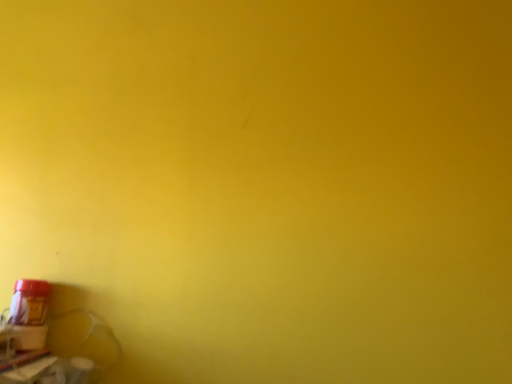
This screenshot has width=512, height=384. Describe the element at coordinates (26, 367) in the screenshot. I see `matte plastic window sill at lower left` at that location.

You are a GUI agent. You are given a task and a screenshot of the screen. Output one action in this format:
    pyautogui.click(x=<x>, y=<y>)
    Task: Click on the matte plastic window sill at lower left
    This screenshot has width=512, height=384.
    Given the screenshot: What is the action you would take?
    pyautogui.click(x=26, y=367)

What is the approximate height of matte red plastic bottle at bottom left?

matte red plastic bottle at bottom left is 4.69 inches tall.

The image size is (512, 384). What do you see at coordinates (29, 314) in the screenshot?
I see `matte red plastic bottle at bottom left` at bounding box center [29, 314].

Where is `matte red plastic bottle at bottom left`? The image size is (512, 384). matte red plastic bottle at bottom left is located at coordinates point(29,314).

This screenshot has width=512, height=384. I want to click on matte plastic window sill at lower left, so click(26, 367).

In the image, is matte red plastic bottle at bottom left on the left side or the right side of matte plastic window sill at lower left?

Based on their positions, matte red plastic bottle at bottom left is located to the right of matte plastic window sill at lower left.

Is matte red plastic bottle at bottom left closer to the viewer compared to matte plastic window sill at lower left?

No, matte red plastic bottle at bottom left is behind matte plastic window sill at lower left.

Considering the points (14, 299) and (52, 357), which point is in front, point (14, 299) or point (52, 357)?

Positioned in front is point (52, 357).

From the image's perspective, is matte red plastic bottle at bottom left on top of matte plastic window sill at lower left?

Yes.

From a real-world perspective, is matte red plastic bottle at bottom left on top of matte plastic window sill at lower left?

Correct, in the physical world, matte red plastic bottle at bottom left is higher than matte plastic window sill at lower left.

Considering the relative sizes of matte red plastic bottle at bottom left and matte plastic window sill at lower left in the image provided, is matte red plastic bottle at bottom left wider than matte plastic window sill at lower left?

In fact, matte red plastic bottle at bottom left might be narrower than matte plastic window sill at lower left.

In terms of height, does matte red plastic bottle at bottom left look taller or shorter compared to matte plastic window sill at lower left?

In the image, matte red plastic bottle at bottom left appears to be taller than matte plastic window sill at lower left.

Based on the photo, between matte red plastic bottle at bottom left and matte plastic window sill at lower left, which one has smaller size?

matte red plastic bottle at bottom left is smaller.

In the scene shown: Is matte red plastic bottle at bottom left not inside matte plastic window sill at lower left?

Indeed, matte red plastic bottle at bottom left is completely outside matte plastic window sill at lower left.

Would you consider matte red plastic bottle at bottom left to be distant from matte plastic window sill at lower left?

matte red plastic bottle at bottom left is near matte plastic window sill at lower left, not far away.

Could you tell me if matte red plastic bottle at bottom left is turned towards matte plastic window sill at lower left?

No, matte red plastic bottle at bottom left is not aimed at matte plastic window sill at lower left.

Based on the photo, can you tell me how much matte red plastic bottle at bottom left and matte plastic window sill at lower left differ in facing direction?

They differ by 1.66 degrees in their facing directions.

Measure the distance between matte red plastic bottle at bottom left and matte plastic window sill at lower left.

The distance of matte red plastic bottle at bottom left from matte plastic window sill at lower left is 2.12 inches.

Locate an element on the screen. The width and height of the screenshot is (512, 384). window sill in front of the matte red plastic bottle at bottom left is located at coordinates (26, 367).

Which object is positioned more to the right, matte plastic window sill at lower left or matte red plastic bottle at bottom left?

Positioned to the right is matte red plastic bottle at bottom left.

Which object is closer to the camera, matte plastic window sill at lower left or matte red plastic bottle at bottom left?

Positioned in front is matte plastic window sill at lower left.

Considering the points (46, 365) and (10, 305), which point is in front, point (46, 365) or point (10, 305)?

Positioned in front is point (46, 365).

Looking at this image, from the image's perspective, between matte plastic window sill at lower left and matte red plastic bottle at bottom left, which one is located above?

matte red plastic bottle at bottom left.

From a real-world perspective, is matte plastic window sill at lower left beneath matte red plastic bottle at bottom left?

Yes, from a real-world perspective, matte plastic window sill at lower left is below matte red plastic bottle at bottom left.

Considering the sizes of objects matte plastic window sill at lower left and matte red plastic bottle at bottom left in the image provided, who is wider, matte plastic window sill at lower left or matte red plastic bottle at bottom left?

Wider between the two is matte plastic window sill at lower left.

From their relative heights in the image, would you say matte plastic window sill at lower left is taller or shorter than matte red plastic bottle at bottom left?

Considering their sizes, matte plastic window sill at lower left has less height than matte red plastic bottle at bottom left.

Consider the image. Can you confirm if matte plastic window sill at lower left is smaller than matte red plastic bottle at bottom left?

Actually, matte plastic window sill at lower left might be larger than matte red plastic bottle at bottom left.

Is matte plastic window sill at lower left not inside matte red plastic bottle at bottom left?

Yes, matte plastic window sill at lower left is outside of matte red plastic bottle at bottom left.

Is matte plastic window sill at lower left directly adjacent to matte red plastic bottle at bottom left?

Indeed, matte plastic window sill at lower left and matte red plastic bottle at bottom left are beside each other and touching.

Is matte plastic window sill at lower left facing towards matte red plastic bottle at bottom left?

No.

What's the angular difference between matte plastic window sill at lower left and matte red plastic bottle at bottom left's facing directions?

The angle between the facing direction of matte plastic window sill at lower left and the facing direction of matte red plastic bottle at bottom left is 1.66 degrees.

Where is `bottle above the matte plastic window sill at lower left (from the image's perspective)`? Image resolution: width=512 pixels, height=384 pixels. bottle above the matte plastic window sill at lower left (from the image's perspective) is located at coordinates (29, 314).

I want to click on bottle above the matte plastic window sill at lower left (from the image's perspective), so pyautogui.click(x=29, y=314).

This screenshot has width=512, height=384. I want to click on window sill below the matte red plastic bottle at bottom left (from the image's perspective), so click(x=26, y=367).